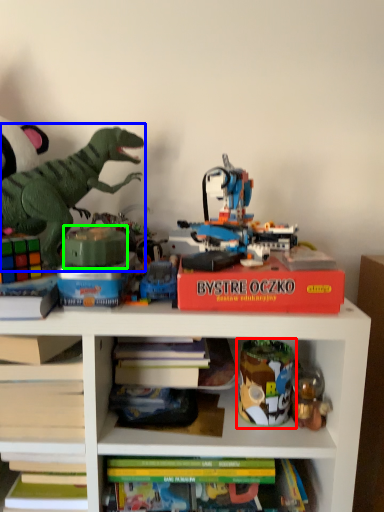
Question: Considering the real-world distances, which object is closest to toy (highlighted by a red box)? toy (highlighted by a blue box) or toy (highlighted by a green box).

Choices:
 (A) toy
 (B) toy

Answer: (B)